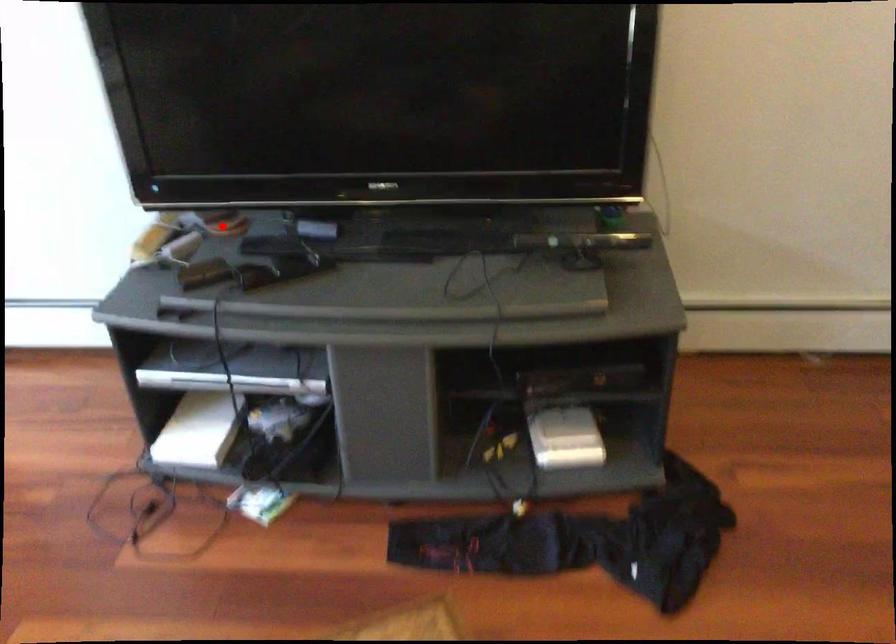
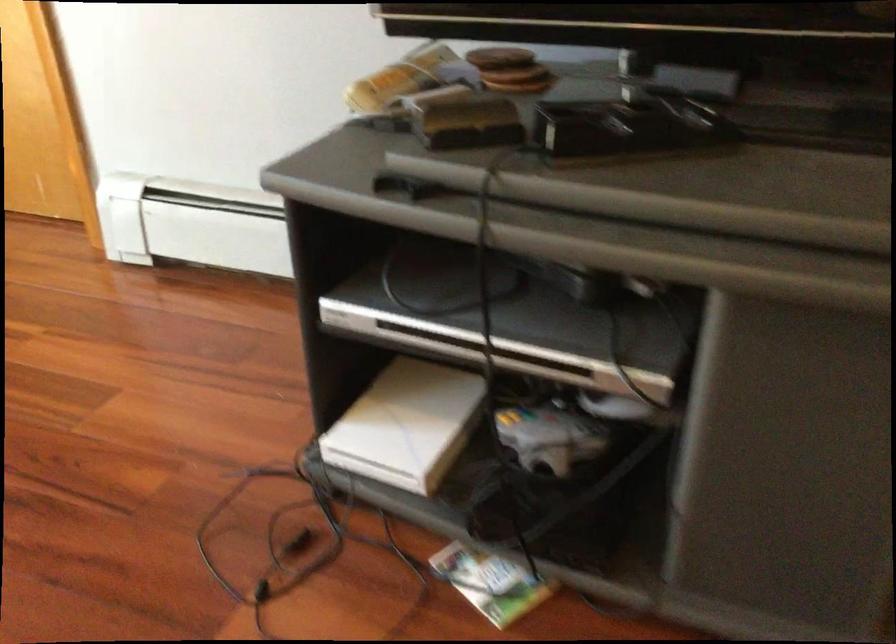
Find the pixel in the second image that matches the highlighted location in the first image.

(519, 80)